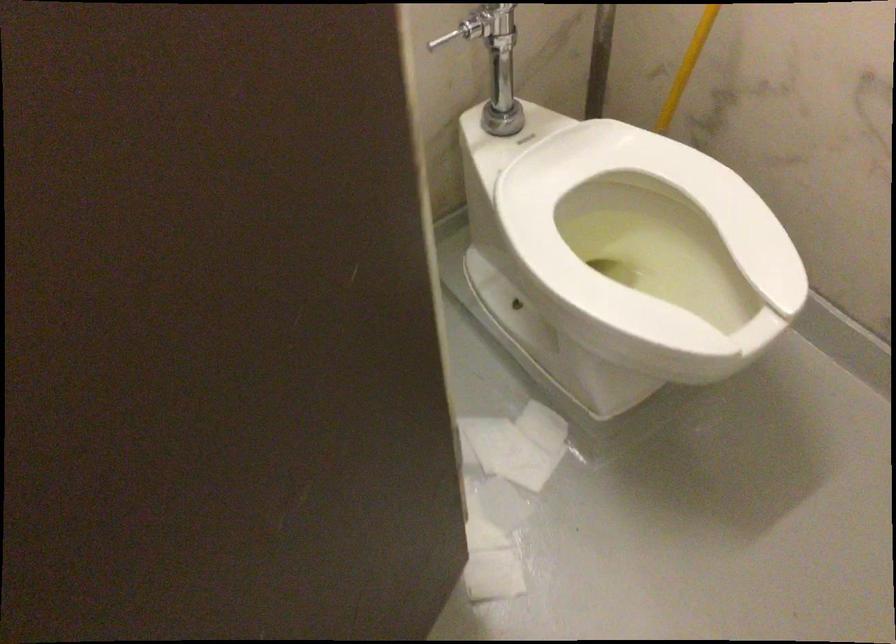
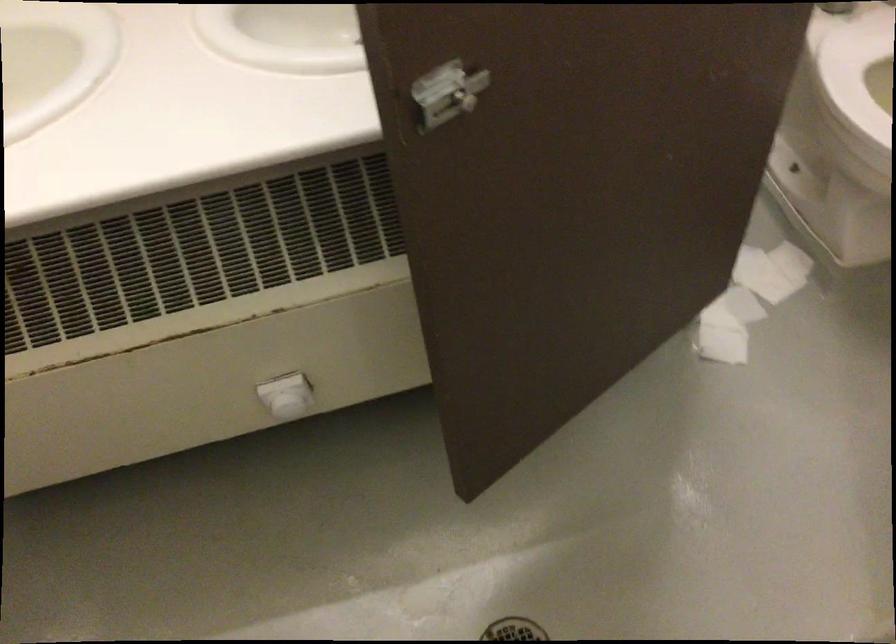
Find the pixel in the second image that matches (550,431) in the first image.

(790, 261)